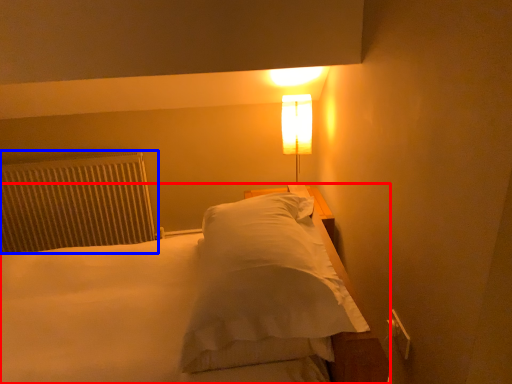
Question: Which object appears closest to the camera in this image, bed (highlighted by a red box) or radiator (highlighted by a blue box)?

Choices:
 (A) bed
 (B) radiator

Answer: (A)